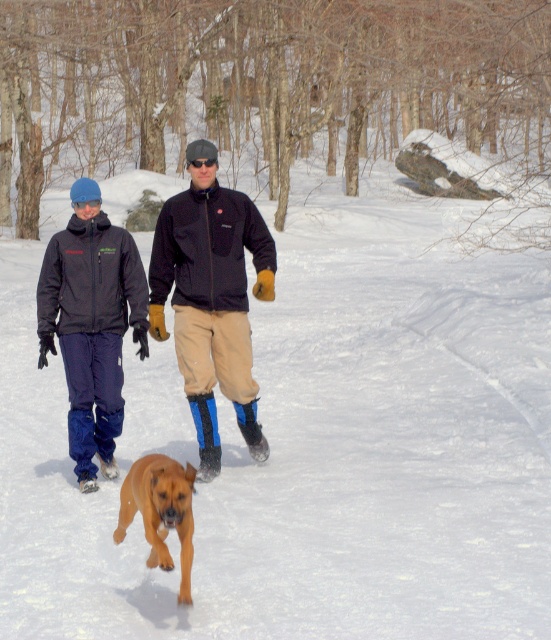
Question: Which point is closer to the camera taking this photo?

Choices:
 (A) (197, 429)
 (B) (153, 522)

Answer: (B)

Question: Does matte black jacket at left have a larger size compared to golden brown fur at center?

Choices:
 (A) yes
 (B) no

Answer: (A)

Question: Can you confirm if khaki pants at center is smaller than golden brown fur at center?

Choices:
 (A) yes
 (B) no

Answer: (B)

Question: Which of these objects is positioned farthest from the golden brown fur at center?

Choices:
 (A) khaki pants at center
 (B) matte black jacket at left

Answer: (B)

Question: Which point is closer to the camera?

Choices:
 (A) khaki pants at center
 (B) matte black jacket at left

Answer: (A)

Question: Is khaki pants at center further to the viewer compared to matte black jacket at left?

Choices:
 (A) yes
 (B) no

Answer: (B)